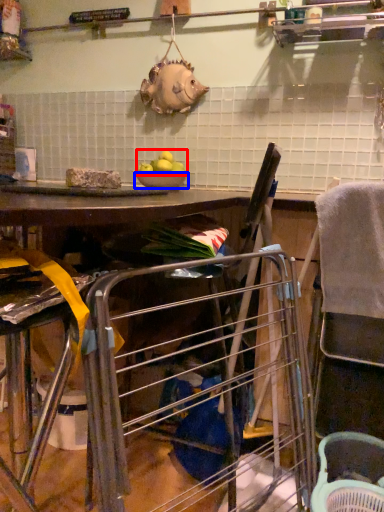
Question: Which point is closer to the camera, fruit (highlighted by a red box) or bowl (highlighted by a blue box)?

Choices:
 (A) fruit
 (B) bowl

Answer: (A)